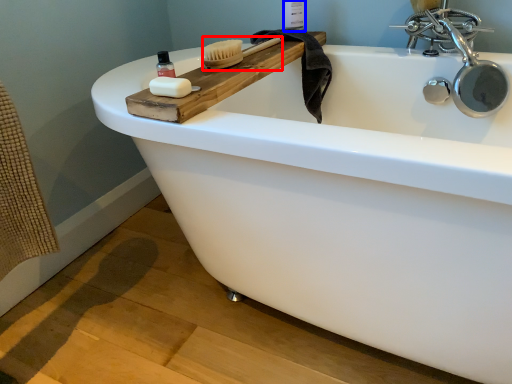
Question: Among these objects, which one is farthest to the camera, brush (highlighted by a red box) or toiletry (highlighted by a blue box)?

Choices:
 (A) brush
 (B) toiletry

Answer: (B)